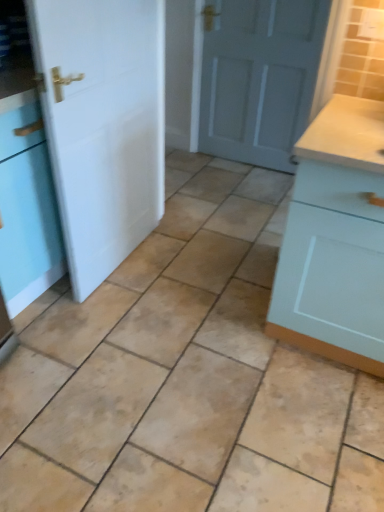
At what (x,y) coordinates should I click in order to perform the action: click on empty space that is in between white matte door at left, which ranks as the second door in right-to-left order, and light blue wood cabinet at right. Please return your answer as a coordinate pair (x, y). Image resolution: width=384 pixels, height=512 pixels. Looking at the image, I should click on (197, 292).